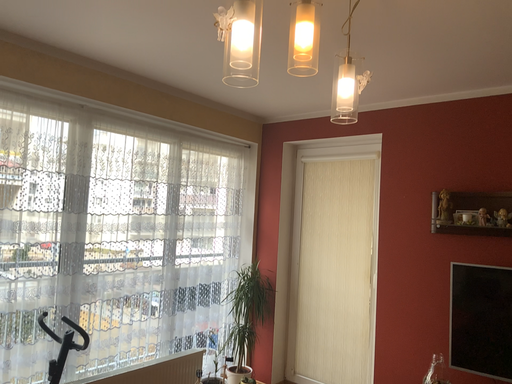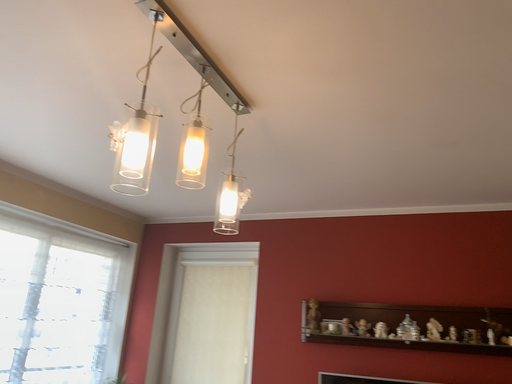
Question: How did the camera likely rotate when shooting the video?

Choices:
 (A) rotated downward
 (B) rotated upward

Answer: (B)